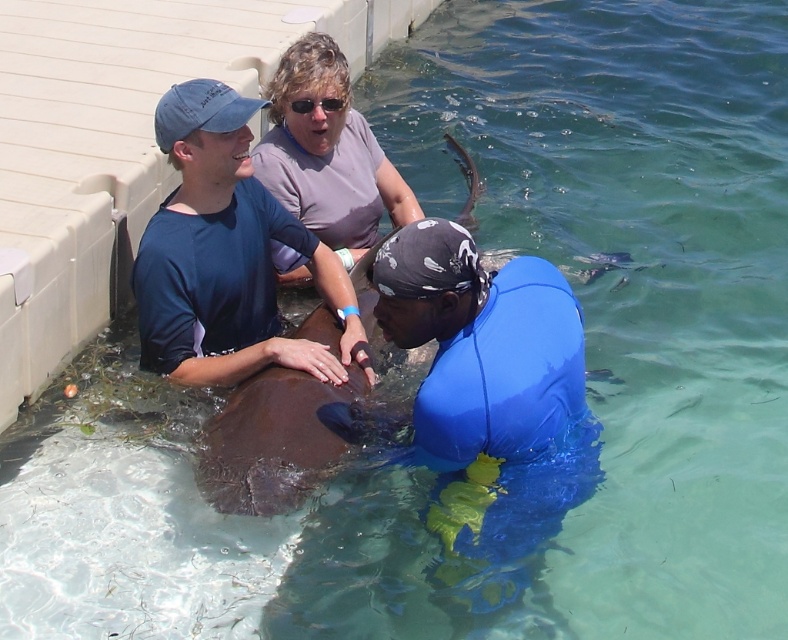
You are standing on the wooden deck on the left side of the frame. You see a point marked at coordinates (489, 392) which is the blue matte wetsuit at lower right. Can you reach the blue matte wetsuit at lower right from your current position without stepping into the water?

The blue matte wetsuit at lower right is located at the point marked by coordinates (489, 392). Since you are on the wooden deck on the left side of the frame, you would need to move across the deck or around the perimeter to reach it without entering the water. However, the scene description does not provide specific details about the deck layout or pathways, so it is uncertain if a dry path exists. The answer cannot be definitively confirmed with the given information.

You are a visitor observing the marine environment scene. You see the blue matte wetsuit at lower right and the purple matte shirt at upper center. Which of these two items is located closer to the bottom of the image?

The blue matte wetsuit at lower right is positioned under the purple matte shirt at upper center, so it is closer to the bottom of the image.

You are a visitor at the marine sanctuary and want to take a photo of both the blue matte wetsuit at lower right and the blue matte shirt at upper left in the same frame. Based on their positions, which one should you focus on first to ensure both are in the shot?

The blue matte wetsuit at lower right is positioned on the right side of the blue matte shirt at upper left, so you should focus on the blue matte shirt at upper left first to ensure both are in the frame.